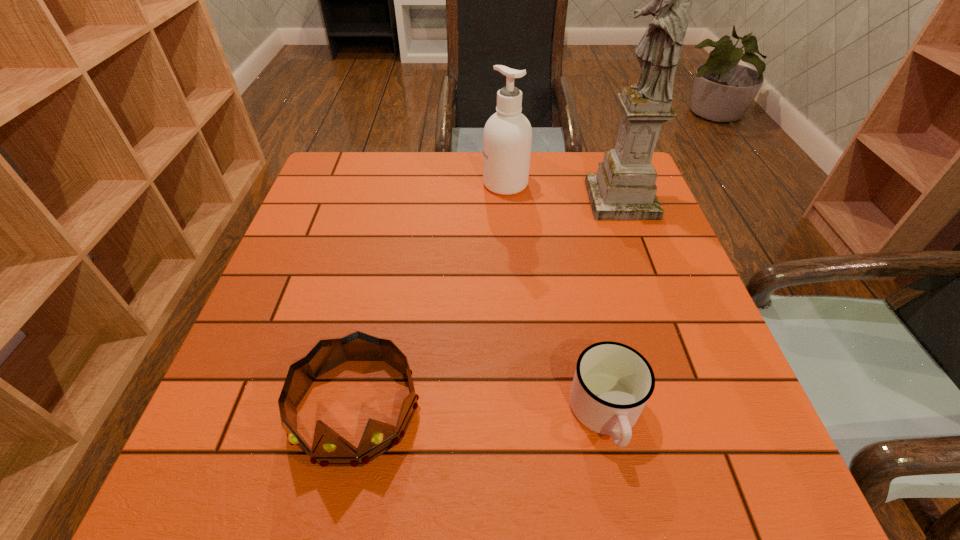
Find the location of a particular element. This screenshot has height=540, width=960. free point located on the front-facing side of the rightmost object is located at coordinates (500, 200).

Locate an element on the screen. vacant space located on the front label of the cleansing agent is located at coordinates (451, 184).

At what (x,y) coordinates should I click in order to perform the action: click on free location located on the front label of the cleansing agent. Please return your answer as a coordinate pair (x, y). This screenshot has height=540, width=960. Looking at the image, I should click on (352, 184).

The image size is (960, 540). Find the location of `free space located on the front label of the cleansing agent`. free space located on the front label of the cleansing agent is located at coordinates (458, 184).

The width and height of the screenshot is (960, 540). In order to click on sculpture situated at the far edge in this screenshot , I will do `click(624, 188)`.

You are a GUI agent. You are given a task and a screenshot of the screen. Output one action in this format:
    pyautogui.click(x=<x>, y=<y>)
    Task: Click on the cleansing agent positioned at the far edge
    This screenshot has height=540, width=960.
    Given the screenshot: What is the action you would take?
    507,138

The width and height of the screenshot is (960, 540). Identify the location of tiara that is at the near edge. (329, 449).

In order to click on mug located in the near edge section of the desktop in this screenshot , I will do `click(612, 383)`.

I want to click on object present at the left edge, so click(x=329, y=449).

Find the location of `object that is positioned at the right edge`. object that is positioned at the right edge is located at coordinates (624, 188).